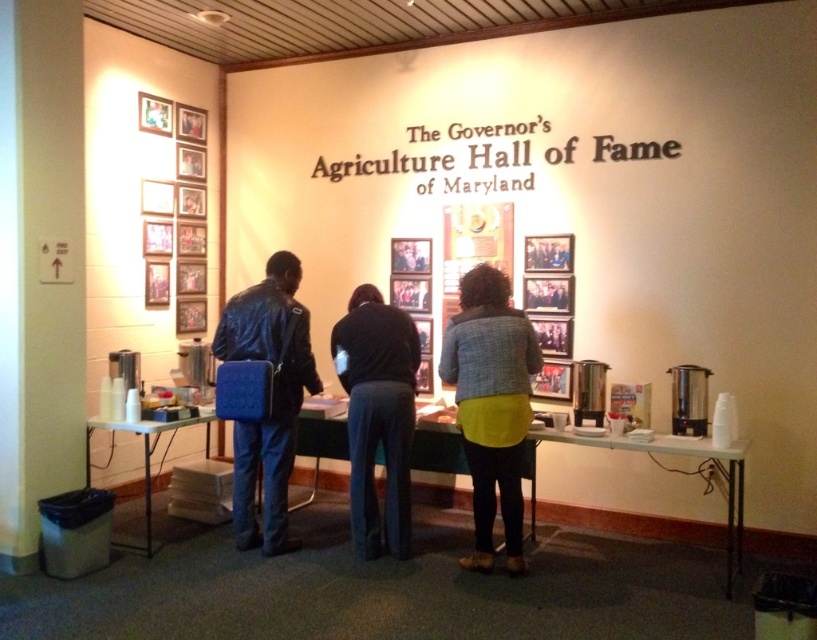
Is blue leather jacket at center bigger than white plastic table at lower center?

No.

Between blue leather jacket at center and white plastic table at lower center, which one appears on the right side from the viewer's perspective?

From the viewer's perspective, white plastic table at lower center appears more on the right side.

Find the location of `blue leather jacket at center`. blue leather jacket at center is located at coordinates (271, 397).

Locate an element on the screen. blue leather jacket at center is located at coordinates (271, 397).

Which is above, blue leather jacket at center or white plastic table at lower left?

Positioned higher is blue leather jacket at center.

Where is `blue leather jacket at center`? blue leather jacket at center is located at coordinates (271, 397).

Is yellow fabric jacket at center closer to camera compared to blue leather jacket at center?

Yes.

Is point (538, 362) positioned in front of point (301, 340)?

Yes.

The image size is (817, 640). Find the location of `yellow fabric jacket at center`. yellow fabric jacket at center is located at coordinates (490, 404).